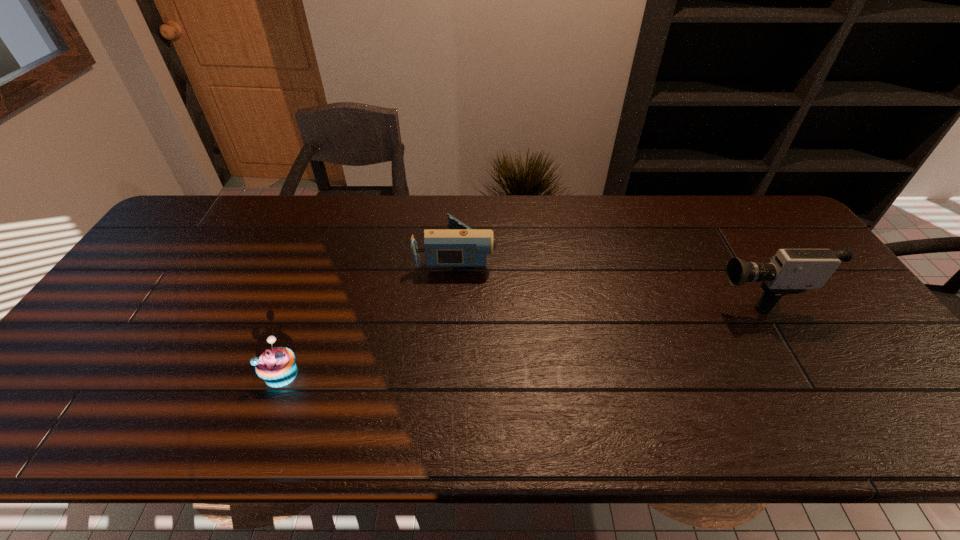
The image size is (960, 540). I want to click on free space between the second shortest object and the shortest object, so click(x=369, y=313).

The height and width of the screenshot is (540, 960). I want to click on vacant point located between the second tallest object and the leftmost object, so click(x=369, y=313).

This screenshot has height=540, width=960. In order to click on free space between the nearest object and the tallest object in this screenshot , I will do `click(516, 333)`.

Identify the location of free space between the leftmost object and the right camcorder. (516, 333).

The height and width of the screenshot is (540, 960). In order to click on empty space between the rightmost object and the leftmost object in this screenshot , I will do `click(516, 333)`.

Find the location of a particular element. vacant space in between the shortest object and the left camcorder is located at coordinates (x=369, y=313).

Find the location of a particular element. vacant area that lies between the leftmost object and the tallest object is located at coordinates (516, 333).

Locate which object is the closest to the left camcorder. Please provide its 2D coordinates. Your answer should be formatted as a tuple, i.e. [(x, y)], where the tuple contains the x and y coordinates of a point satisfying the conditions above.

[(276, 366)]

Identify which object is the second closest to the rightmost object. Please provide its 2D coordinates. Your answer should be formatted as a tuple, i.e. [(x, y)], where the tuple contains the x and y coordinates of a point satisfying the conditions above.

[(276, 366)]

At what (x,y) coordinates should I click in order to perform the action: click on vacant space that satisfies the following two spatial constraints: 1. on the side of the second tallest object with the flip-out screen; 2. on the front side of the nearest object. Please return your answer as a coordinate pair (x, y). This screenshot has width=960, height=540. Looking at the image, I should click on (449, 374).